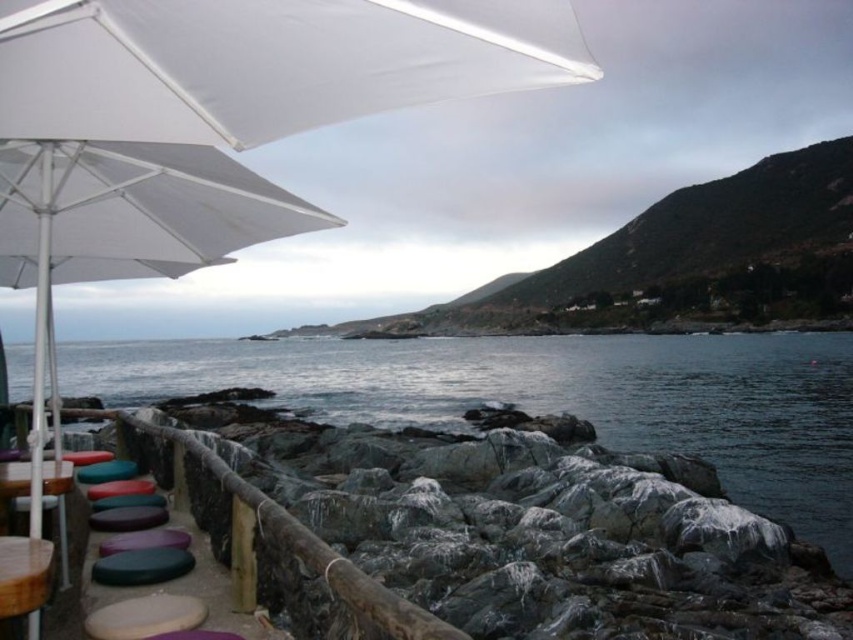
Question: From the image, what is the correct spatial relationship of clear water at lower left in relation to wooden table at lower left?

Choices:
 (A) above
 (B) below

Answer: (B)

Question: Observing the image, what is the correct spatial positioning of white matte umbrella at upper left in reference to wooden table at lower left?

Choices:
 (A) right
 (B) left

Answer: (A)

Question: Which object is closer to the camera taking this photo?

Choices:
 (A) white matte umbrella at upper left
 (B) clear water at lower left
 (C) wooden table at lower left

Answer: (C)

Question: Which is nearer to the white matte umbrella at upper left?

Choices:
 (A) clear water at lower left
 (B) wooden table at lower left

Answer: (B)

Question: Does white matte umbrella at upper left appear over clear water at lower left?

Choices:
 (A) no
 (B) yes

Answer: (B)

Question: Among these points, which one is nearest to the camera?

Choices:
 (A) (12, 580)
 (B) (39, 486)
 (C) (730, 388)

Answer: (A)